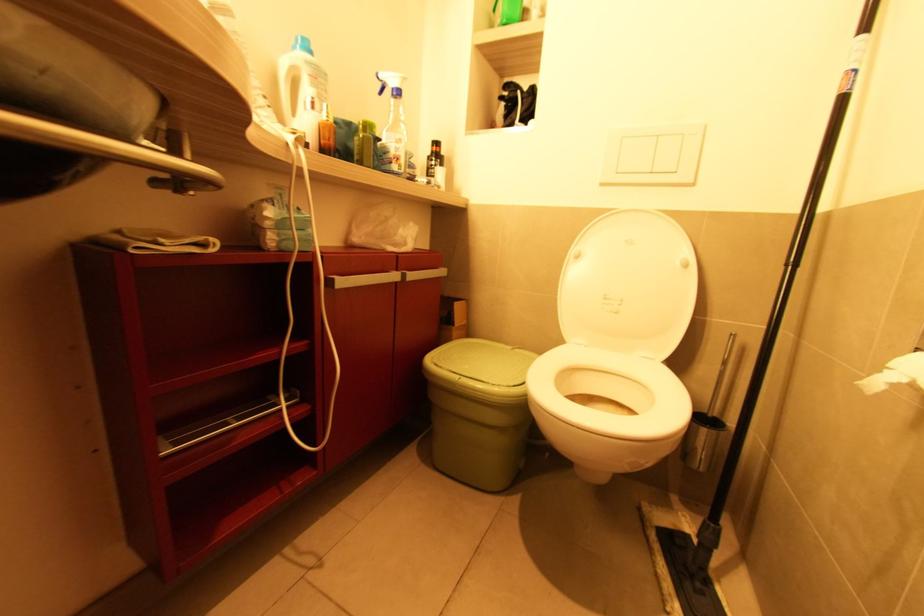
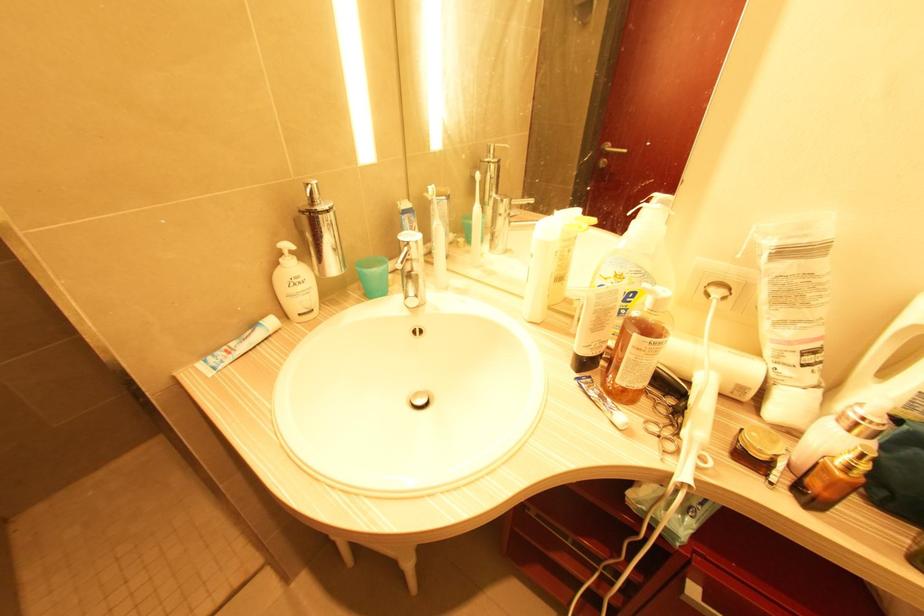
In the second image, find the point that corresponds to (331,119) in the first image.

(850, 468)